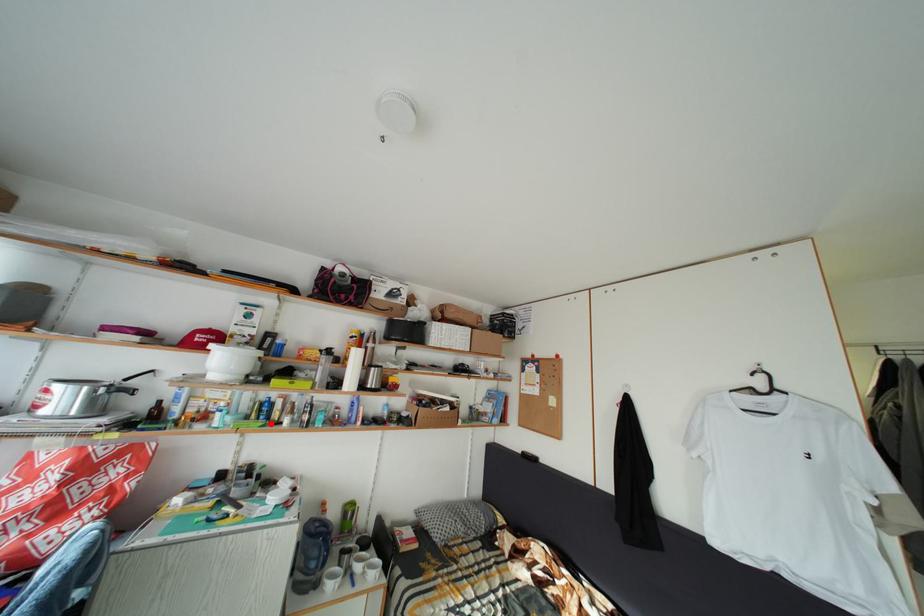
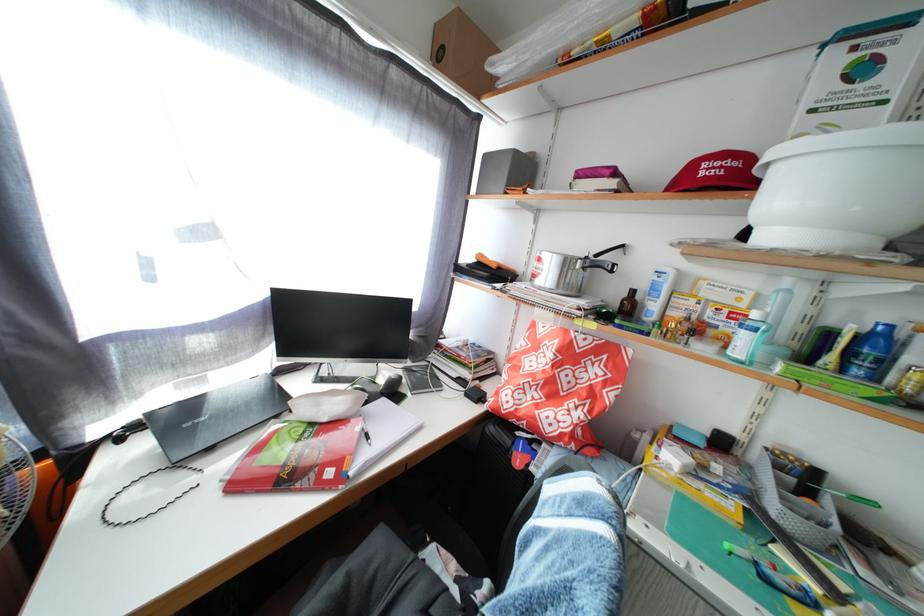
Find the pixel in the second image that matches the highlighted location in the first image.

(866, 378)